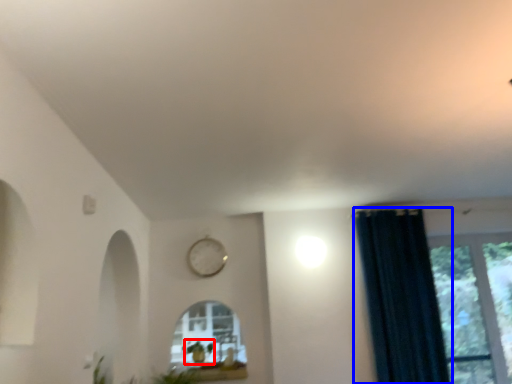
Question: Which object appears farthest to the camera in this image, plant (highlighted by a red box) or curtain (highlighted by a blue box)?

Choices:
 (A) plant
 (B) curtain

Answer: (A)